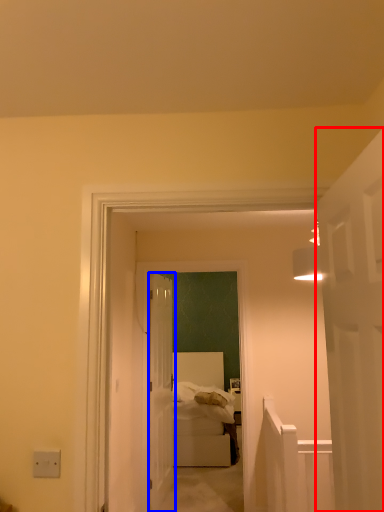
Question: Among these objects, which one is farthest to the camera, door (highlighted by a red box) or door (highlighted by a blue box)?

Choices:
 (A) door
 (B) door

Answer: (B)